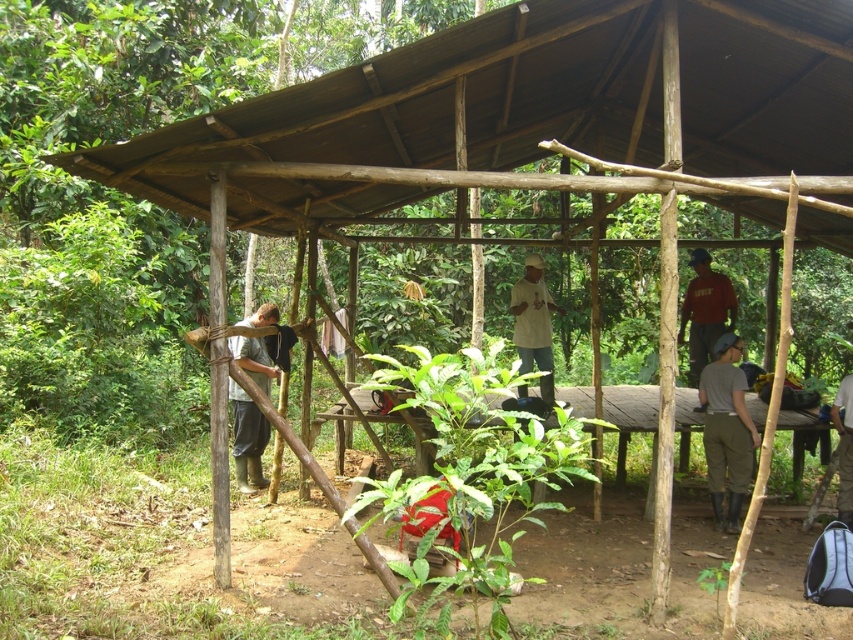
Question: Which of the following is the closest to the observer?

Choices:
 (A) dark red shirt at center
 (B) green matte shirt at left
 (C) dark gray fabric bag at center
 (D) white matte shirt at center

Answer: (C)

Question: Which of the following is the farthest from the observer?

Choices:
 (A) (839, 438)
 (B) (264, 484)
 (C) (706, 481)
 (D) (689, 376)

Answer: (D)

Question: Which object is the farthest from the dark red shirt at center?

Choices:
 (A) white matte shirt at center
 (B) dark gray fabric bag at center
 (C) gray matte pants at lower right
 (D) green matte shirt at left

Answer: (D)

Question: Is gray matte pants at lower right in front of green matte shirt at left?

Choices:
 (A) yes
 (B) no

Answer: (A)

Question: Is dark red shirt at center positioned in front of white matte shirt at center?

Choices:
 (A) no
 (B) yes

Answer: (A)

Question: Can you confirm if dark red shirt at center is wider than white matte shirt at center?

Choices:
 (A) no
 (B) yes

Answer: (B)